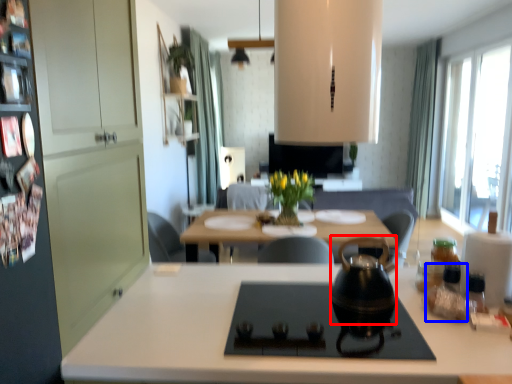
Question: Which object is closer to the camera taking this photo, tea pot (highlighted by a red box) or bottle (highlighted by a blue box)?

Choices:
 (A) tea pot
 (B) bottle

Answer: (A)